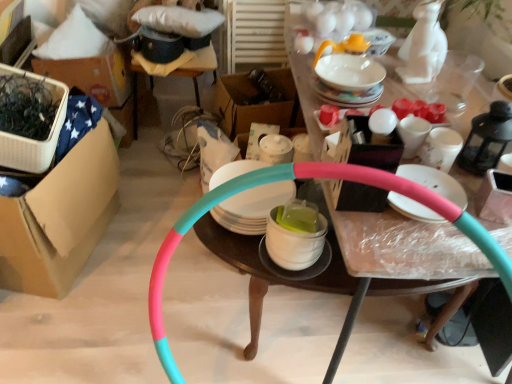
Find the location of a particular element. The image size is (512, 384). free space between white glossy plate at center, acting as the 2th tableware starting from the bottom, and white glossy bowl at center, acting as the first tableware starting from the bottom is located at coordinates (246, 254).